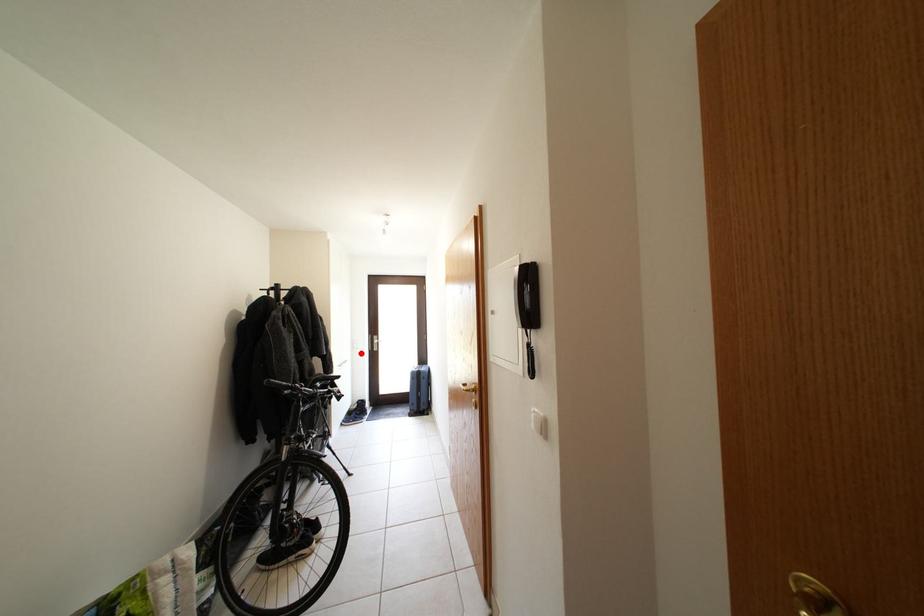
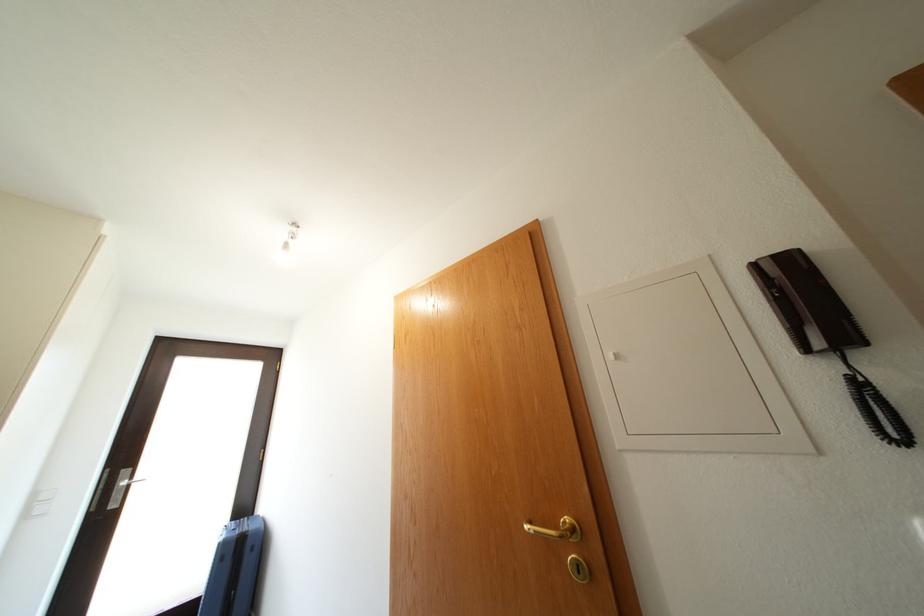
The point at the highlighted location is marked in the first image. Where is the corresponding point in the second image?

(33, 522)